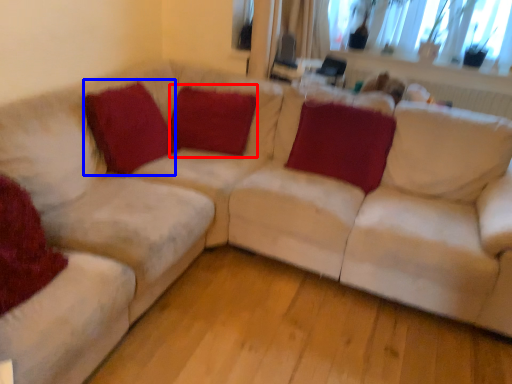
Question: Among these objects, which one is farthest to the camera, pillow (highlighted by a red box) or pillow (highlighted by a blue box)?

Choices:
 (A) pillow
 (B) pillow

Answer: (A)